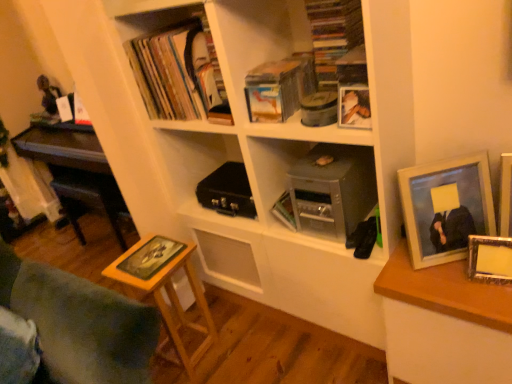
Identify the location of free space above yellow matte board game at lower left, placed as the third book when sorted from right to left (from a real-world perspective). The image size is (512, 384). (143, 254).